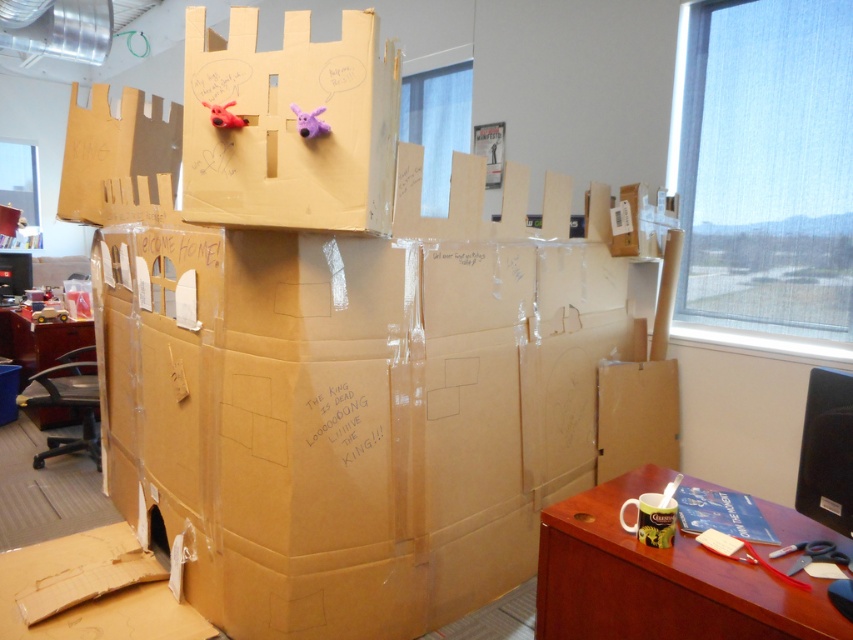
You are a visitor at this cardboard castle and want to sit down to rest. Where is the wooden desk at lower right located in the scene?

The wooden desk at lower right is located at point (659, 580) in the scene.

You are organizing a surprise party in the office and need to place a large banner between the brown cardboard box at center and the wooden desk at lower right. Which object should the banner be closer to if you want it to be near the smaller object?

The banner should be closer to the brown cardboard box at center because it occupies less space than the wooden desk at lower right.

You are setting up a small display in an office and need to place both the brown cardboard box at center and the matte brown table at lower left. Given their sizes, which object should be placed closer to the entrance to ensure there is enough space for visitors to walk around?

The brown cardboard box at center has a lesser width compared to the matte brown table at lower left, so it should be placed closer to the entrance to allow more space for visitors to walk around the wider matte brown table at lower left.